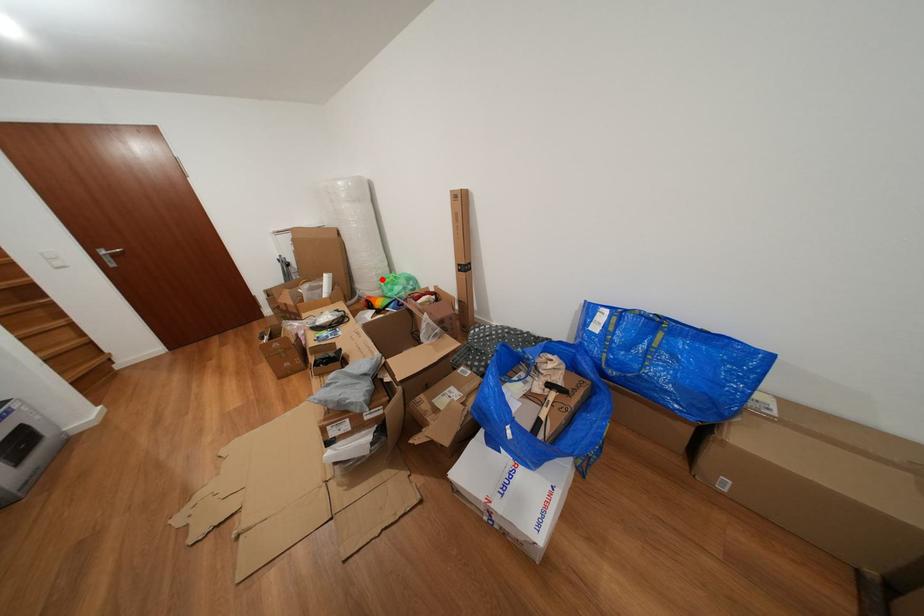
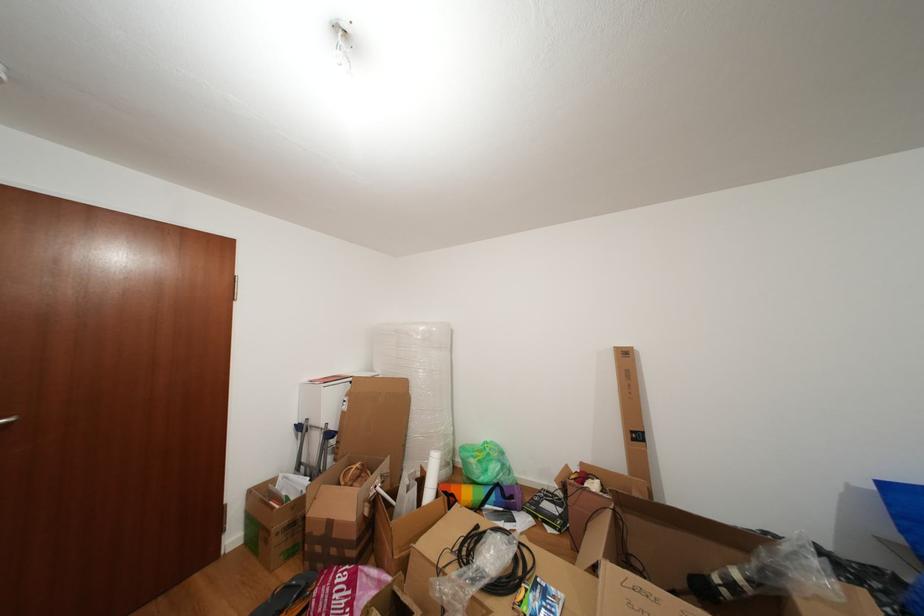
Where in the second image is the point corresponding to the highlighted location from the first image?

(450, 448)